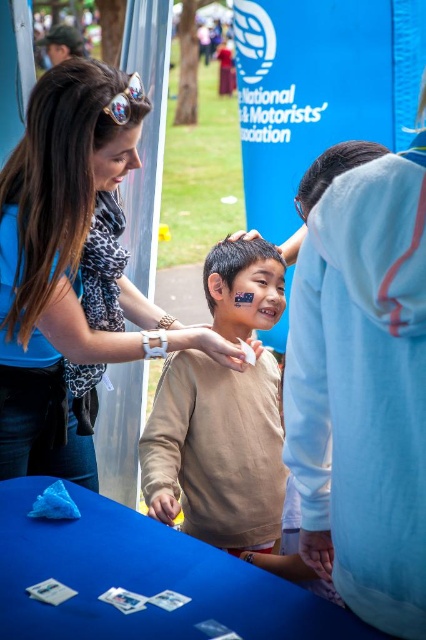
Question: Which point appears closest to the camera in this image?

Choices:
 (A) (235, 518)
 (B) (282, 260)

Answer: (A)

Question: Does brownleopard print scarf at upper left come in front of brown matte hair at center?

Choices:
 (A) no
 (B) yes

Answer: (B)

Question: Can you confirm if blue fabric at upper left is positioned to the right of black smooth hair at upper center?

Choices:
 (A) yes
 (B) no

Answer: (B)

Question: Among these objects, which one is nearest to the camera?

Choices:
 (A) matte white hand at center
 (B) matte blue fabric at lower center
 (C) beige soft sweater at center

Answer: (B)

Question: Which object appears closest to the camera in this image?

Choices:
 (A) beige soft sweater at center
 (B) matte blue fabric at lower center
 (C) brownleopard print scarf at upper left
 (D) blue fabric at upper left

Answer: (B)

Question: Is blue fabric table at lower center above brown matte hair at center?

Choices:
 (A) yes
 (B) no

Answer: (B)